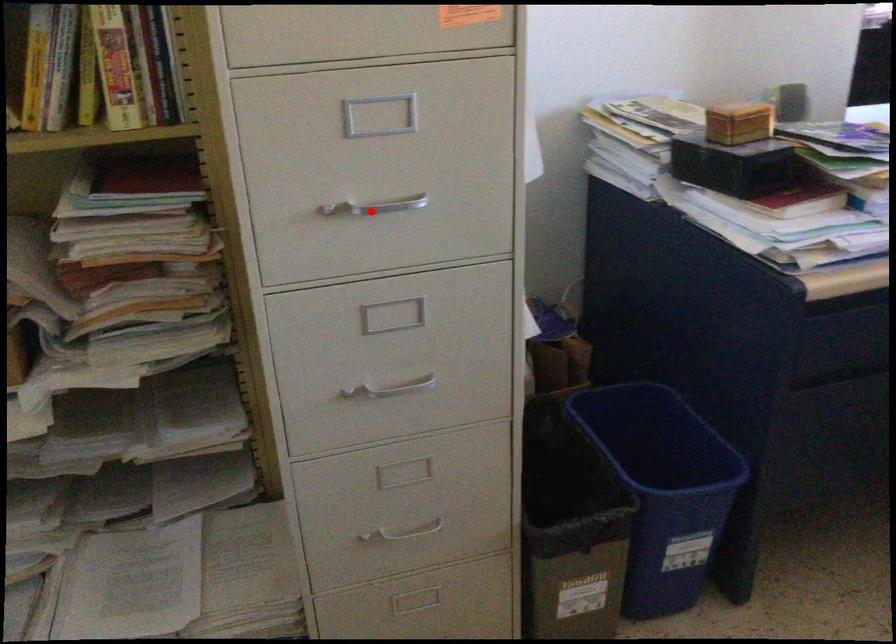
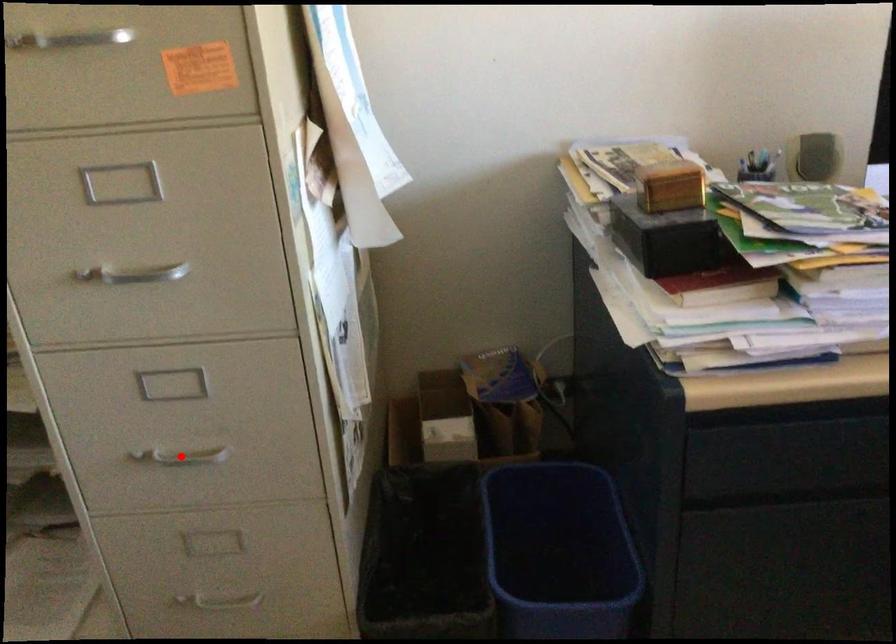
I am providing you with two images of the same scene from different viewpoints. A red point is marked on the first image and another point is marked on the second image. Is the red point in image1 aligned with the point shown in image2?

No